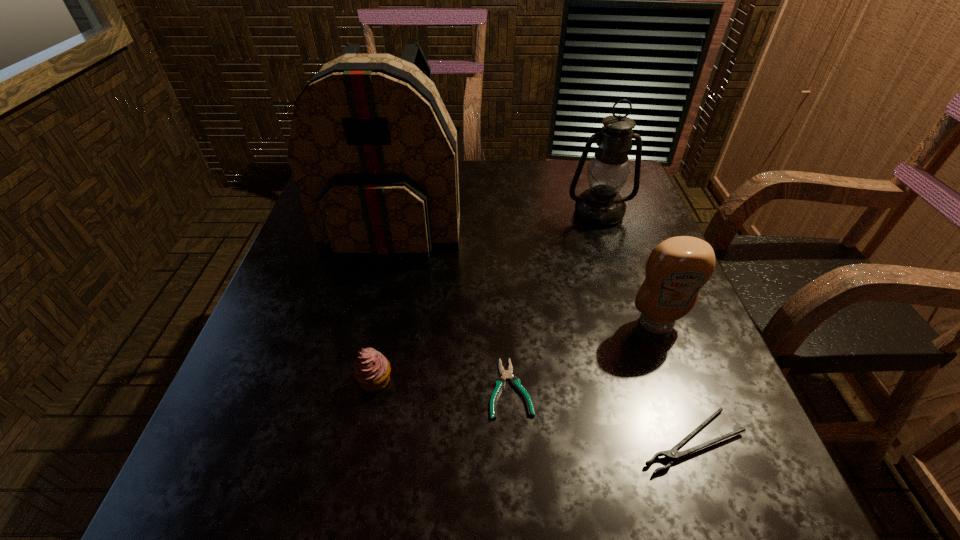
Identify the location of blank space that satisfies the following two spatial constraints: 1. on the front face of the shortest object; 2. on the right side of the tallest object. Image resolution: width=960 pixels, height=540 pixels. (355, 388).

Where is `vacant region that satisfies the following two spatial constraints: 1. on the front face of the fourth object from right to left; 2. on the right side of the backpack`? This screenshot has height=540, width=960. vacant region that satisfies the following two spatial constraints: 1. on the front face of the fourth object from right to left; 2. on the right side of the backpack is located at coordinates (355, 388).